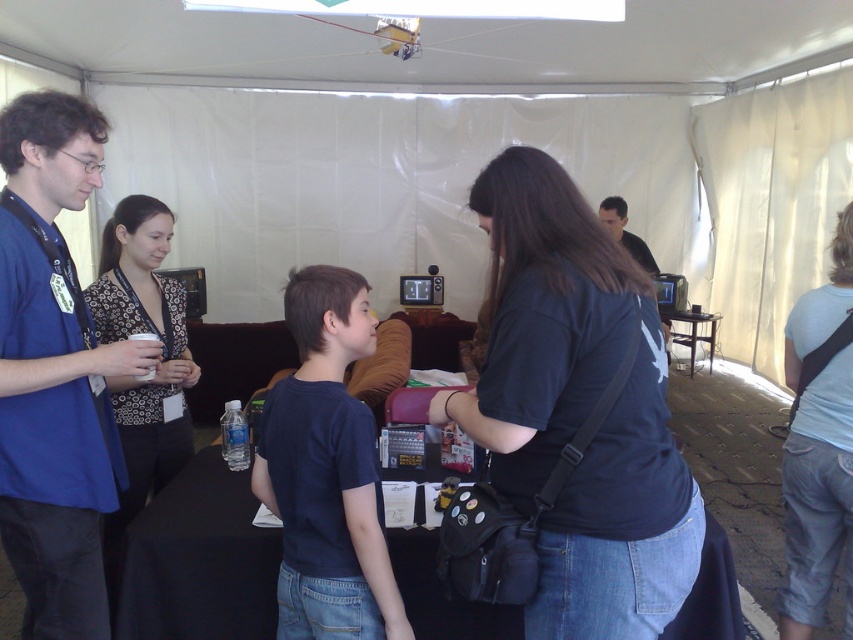
You are standing at the entrance of the tent and want to greet the person wearing the blue shirt at left. In which direction should you walk to reach them?

The blue shirt at left is located at point 0.583 on the x axis and 0.064 on the y axis, so you should walk towards the lower left direction to reach them.

You are organizing a clothing display in the tent and need to arrange the patterned fabric blouse at left and the black matte shirt at upper center based on their height. Which one should you place higher on the rack?

The patterned fabric blouse at left is taller than the black matte shirt at upper center, so you should place the patterned fabric blouse at left higher on the rack.